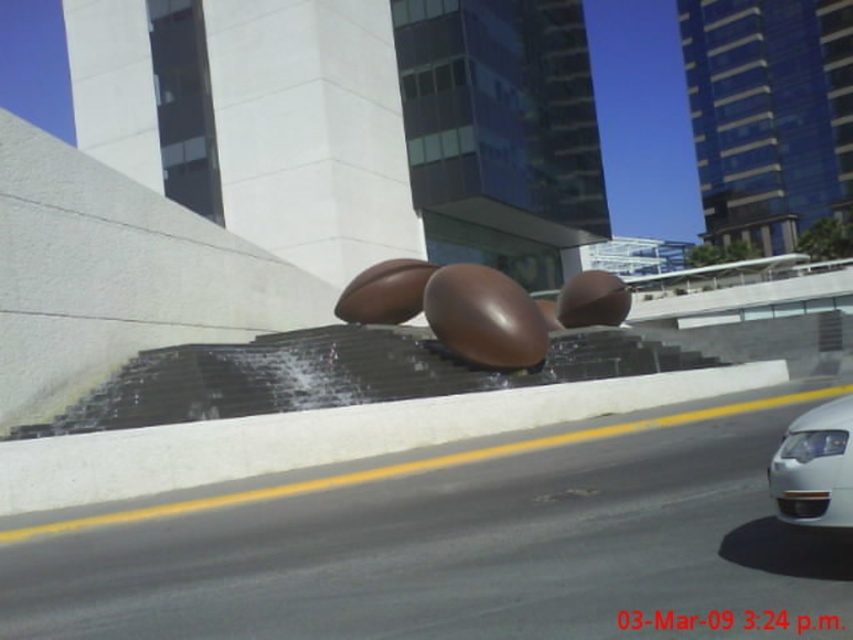
Is shiny brown eggs at center above white glossy car at right?

Correct, shiny brown eggs at center is located above white glossy car at right.

Is shiny brown eggs at center to the left of white glossy car at right from the viewer's perspective?

Correct, you'll find shiny brown eggs at center to the left of white glossy car at right.

The image size is (853, 640). I want to click on shiny brown eggs at center, so click(453, 308).